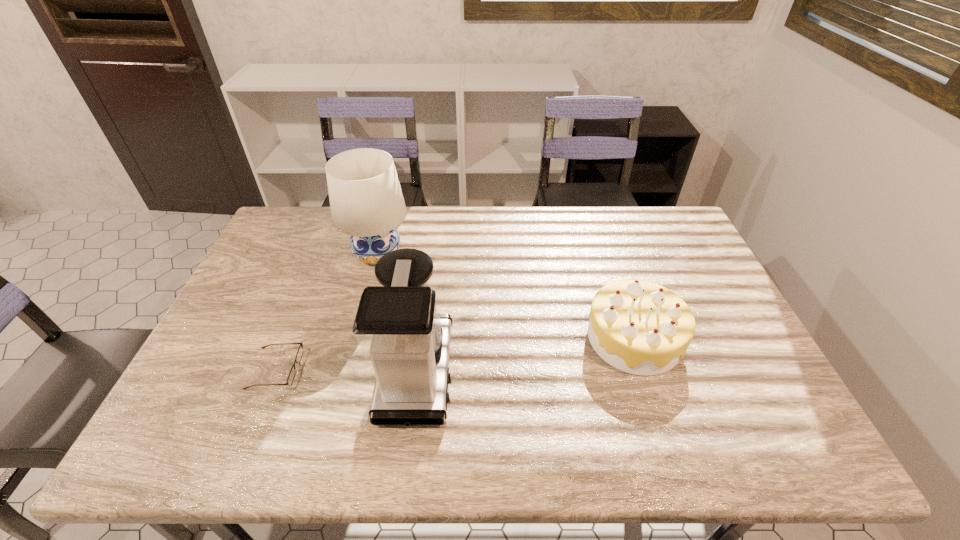
You are a GUI agent. You are given a task and a screenshot of the screen. Output one action in this format:
    pyautogui.click(x=<x>, y=<y>)
    Task: Click on the object at the far edge
    
    Given the screenshot: What is the action you would take?
    pyautogui.click(x=366, y=201)

In order to click on object situated at the near edge in this screenshot , I will do `click(398, 326)`.

At what (x,y) coordinates should I click in order to perform the action: click on object present at the left edge. Please return your answer as a coordinate pair (x, y). Looking at the image, I should click on (299, 354).

Locate an element on the screen. The width and height of the screenshot is (960, 540). free spot at the far edge of the desktop is located at coordinates (317, 242).

This screenshot has height=540, width=960. In the image, there is a desktop. In order to click on vacant space at the left edge in this screenshot , I will do `click(264, 353)`.

Where is `free space at the right edge`? The width and height of the screenshot is (960, 540). free space at the right edge is located at coordinates (663, 277).

You are a GUI agent. You are given a task and a screenshot of the screen. Output one action in this format:
    pyautogui.click(x=<x>, y=<y>)
    Task: Click on the vacant space at the near left corner of the desktop
    The height and width of the screenshot is (540, 960).
    Given the screenshot: What is the action you would take?
    pyautogui.click(x=216, y=444)

Where is `free space at the far right corner`? This screenshot has width=960, height=540. free space at the far right corner is located at coordinates (657, 232).

Identify the location of free spot between the farthest object and the shortest object. (326, 312).

The height and width of the screenshot is (540, 960). Find the location of `vacant region between the lampshade and the spectacles`. vacant region between the lampshade and the spectacles is located at coordinates (326, 312).